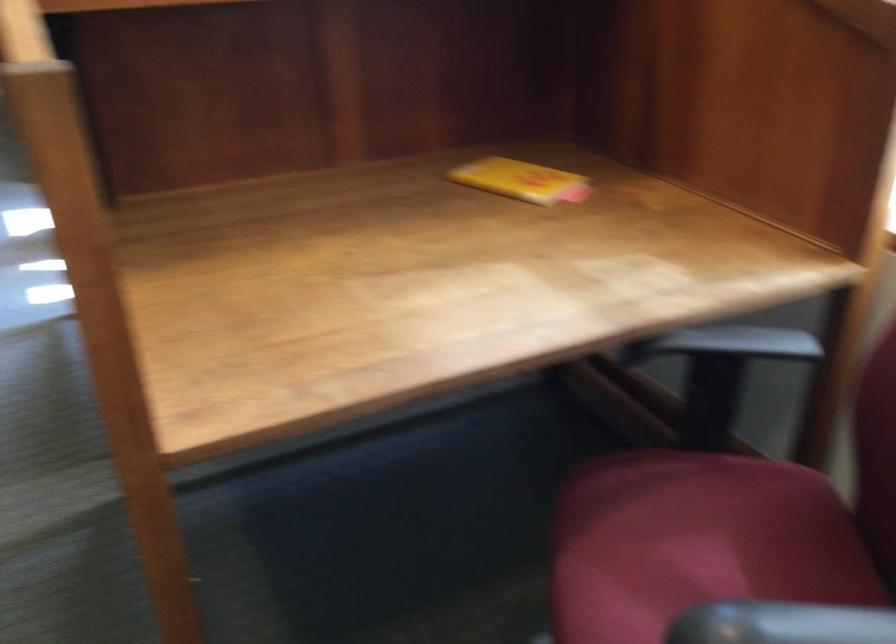
Question: The camera is either moving clockwise (left) or counter-clockwise (right) around the object. The first image is from the beginning of the video and the second image is from the end. Is the camera moving left or right when shooting the video?

Choices:
 (A) Left
 (B) Right

Answer: (B)